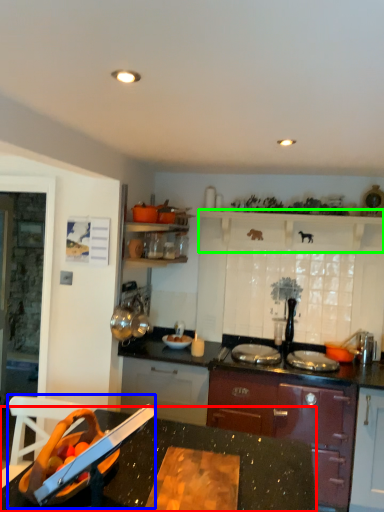
Question: Which is farther away from countertop (highlighted by a red box)? sink (highlighted by a blue box) or shelf (highlighted by a green box)?

Choices:
 (A) sink
 (B) shelf

Answer: (B)